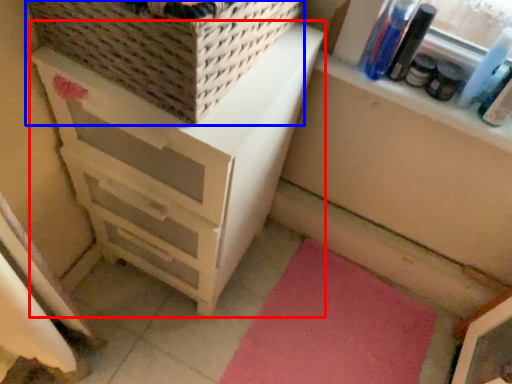
Question: Among these objects, which one is farthest to the camera, chest of drawers (highlighted by a red box) or basket (highlighted by a blue box)?

Choices:
 (A) chest of drawers
 (B) basket

Answer: (A)